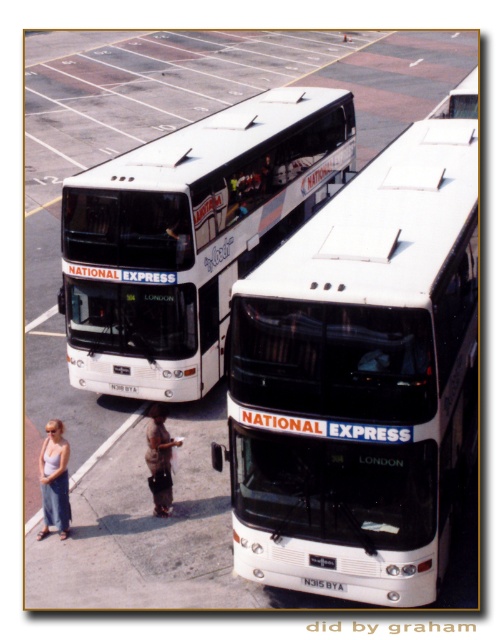
Question: Which of the following is the farthest from the observer?

Choices:
 (A) (62, 452)
 (B) (430, 140)

Answer: (B)

Question: Which of these objects is positioned farthest from the denim skirt at lower left?

Choices:
 (A) white matte double-decker bus at center
 (B) white matte bus at center

Answer: (A)

Question: In this image, where is white matte bus at center located relative to white matte double-decker bus at center?

Choices:
 (A) left
 (B) right

Answer: (B)

Question: Is denim skirt at lower left below brown fabric shorts at center?

Choices:
 (A) yes
 (B) no

Answer: (A)

Question: Is white matte double-decker bus at center to the left of brown fabric shorts at center from the viewer's perspective?

Choices:
 (A) no
 (B) yes

Answer: (A)

Question: Which point is closer to the camera?

Choices:
 (A) white matte double-decker bus at center
 (B) brown fabric shorts at center
 (C) denim skirt at lower left
 (D) white matte bus at center

Answer: (D)